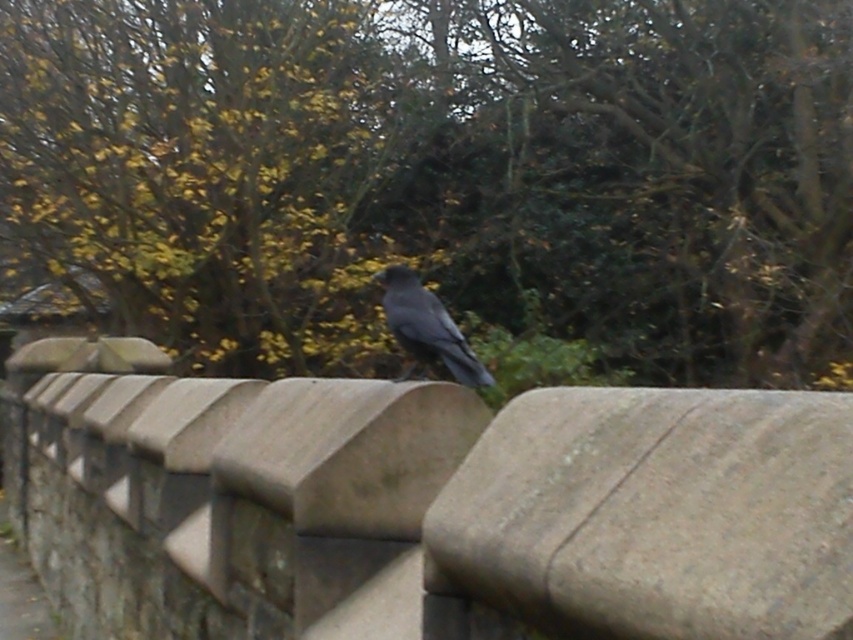
Looking at this image, you are a photographer trying to capture the shiny black bird at center perched on the gray stone wall at center. Considering their sizes, which object would require a wider angle lens to include fully in the photo?

The gray stone wall at center has a larger size compared to the shiny black bird at center, so the photographer would need a wider angle lens to include the gray stone wall at center fully in the photo.

You are standing in a park and see the green leafy tree at upper center and the gray stone wall at center. Which object is higher in the image?

The green leafy tree at upper center is above the gray stone wall at center in the image.

You are a birdwatcher observing the scene. You notice the shiny black bird at center and the gray stone wall at center. Which object is positioned higher in the image?

The shiny black bird at center is positioned higher than the gray stone wall at center.